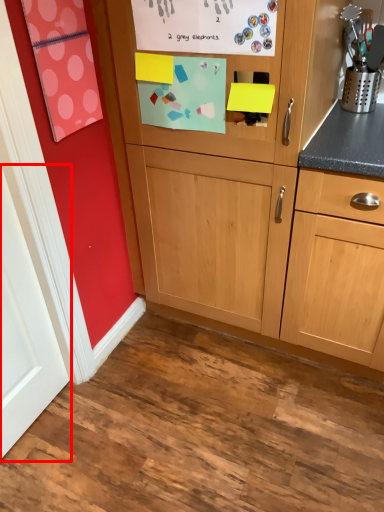
Question: From the image's perspective, considering the relative positions of door (annotated by the red box) and cabinetry in the image provided, where is door (annotated by the red box) located with respect to the staircase?

Choices:
 (A) above
 (B) below

Answer: (B)